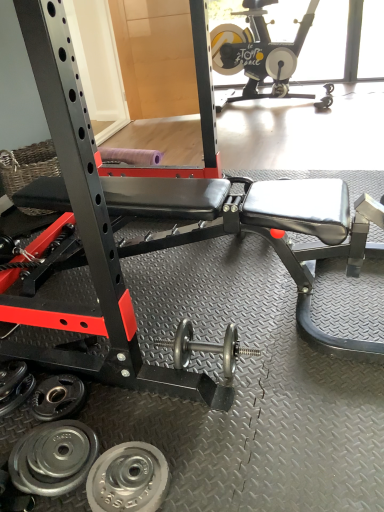
Question: In the image, is silver metallic weight plate at lower left, arranged as the 3th wheel when viewed from the front, positioned in front of or behind polished silver dumbbell at center?

Choices:
 (A) front
 (B) behind

Answer: (B)

Question: From the image's perspective, is silver metallic weight plate at lower left, which ranks as the 1th wheel in back-to-front order, located above or below polished silver dumbbell at center?

Choices:
 (A) below
 (B) above

Answer: (A)

Question: Which object is the farthest from the polished silver dumbbell at center?

Choices:
 (A) silver metallic weight plate at lower left, the third wheel positioned from the back
 (B) black matte stationary bike at upper right
 (C) silver metallic weight plate at lower left, which ranks as the second wheel in front-to-back order
 (D) silver metallic weight plate at lower left, arranged as the 3th wheel when viewed from the front

Answer: (B)

Question: Considering the real-world distances, which object is farthest from the silver metallic weight plate at lower left, the third wheel positioned from the back?

Choices:
 (A) black matte stationary bike at upper right
 (B) silver metallic weight plate at lower left, which ranks as the second wheel in front-to-back order
 (C) silver metallic weight plate at lower left, which ranks as the 1th wheel in back-to-front order
 (D) polished silver dumbbell at center

Answer: (A)